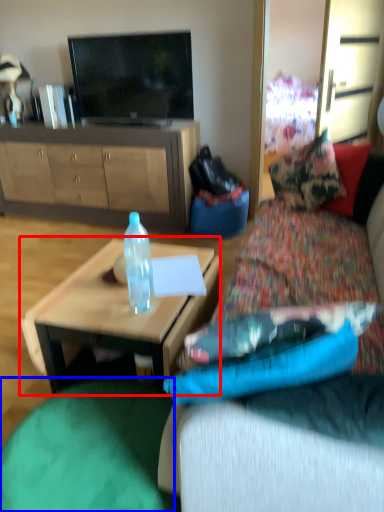
Question: Which object appears farthest to the camera in this image, coffee table (highlighted by a red box) or bean bag chair (highlighted by a blue box)?

Choices:
 (A) coffee table
 (B) bean bag chair

Answer: (A)